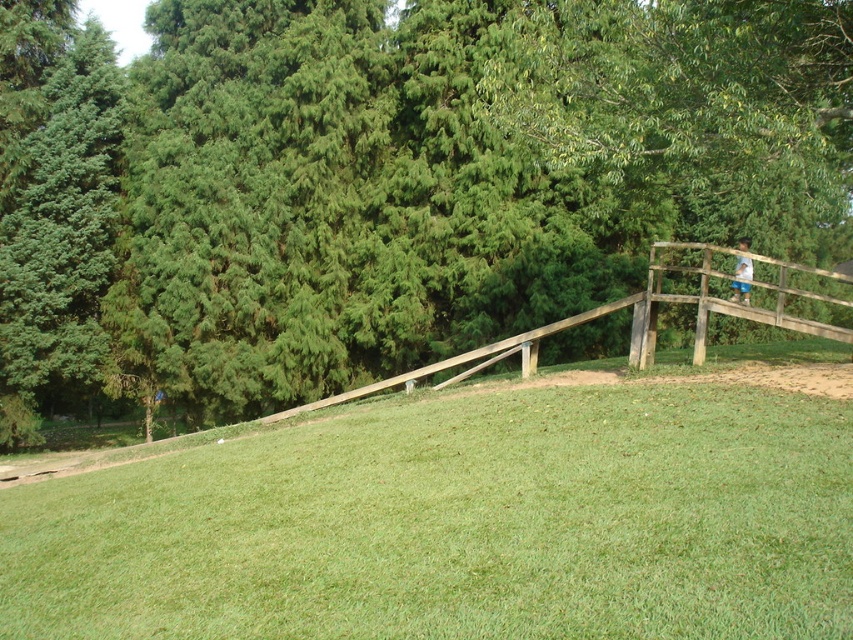
You are standing on the wooden bridge and looking towards the green leafy tree at upper center. Is the wooden rail at right blocking your view of the tree?

The green leafy tree at upper center is in front of the wooden rail at right, so the rail is not blocking the view of the tree.

You are a parent trying to locate your child in a park. You see the wooden rail at right and the blue denim shorts at upper right. Which object is closer to you?

The blue denim shorts at upper right are closer to you since they are only 8.25 feet away from the wooden rail at right, but without knowing the exact distance from your position, it is impossible to determine which is closer.

You are a park ranger who needs to place a 5 meter long safety barrier between the green leafy tree at upper center and the wooden rail at right. Is there enough space to place it without overlapping either object?

The distance between the green leafy tree at upper center and the wooden rail at right is 5.31 meters. Since the safety barrier is 5 meters long, there is enough space to place it between them without overlapping either object, as 5 meters is less than 5.31 meters.